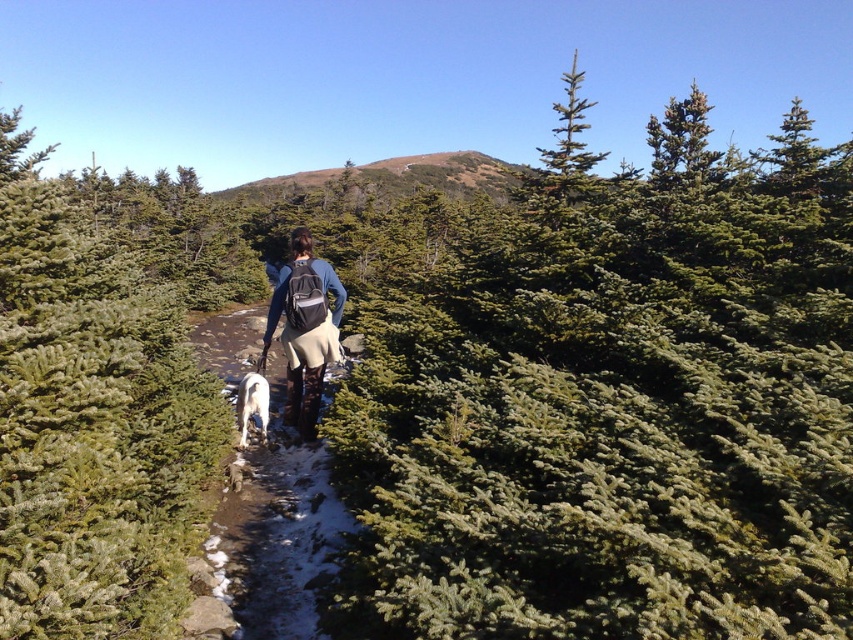
Question: Can you confirm if green needle-like trees at center is wider than white fluffy dog at center?

Choices:
 (A) no
 (B) yes

Answer: (B)

Question: Does green needle-like at center have a greater width compared to green needle-like trees at center?

Choices:
 (A) yes
 (B) no

Answer: (A)

Question: Is the position of green needle-like at center more distant than that of brown grassy hillside at center?

Choices:
 (A) yes
 (B) no

Answer: (B)

Question: Which point is closer to the camera?

Choices:
 (A) (280, 556)
 (B) (427, 163)
 (C) (589, 259)

Answer: (A)

Question: Among these points, which one is farthest from the camera?

Choices:
 (A) (718, 284)
 (B) (199, 337)

Answer: (B)

Question: Among these objects, which one is nearest to the camera?

Choices:
 (A) white fur dog at center
 (B) green needle-like trees at center
 (C) white fluffy dog at center
 (D) matte black backpack at center

Answer: (B)